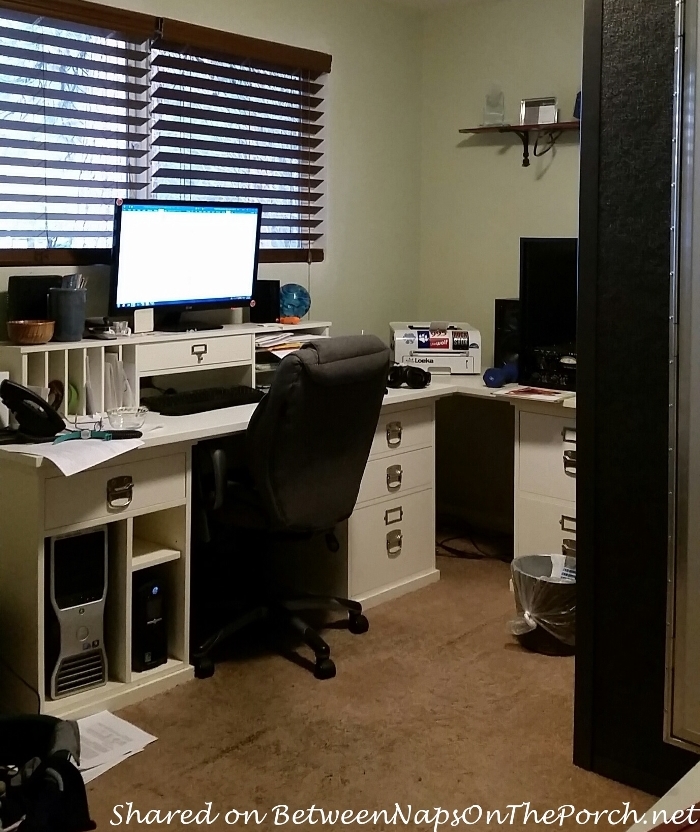
Where is `floor`? floor is located at coordinates (396, 729).